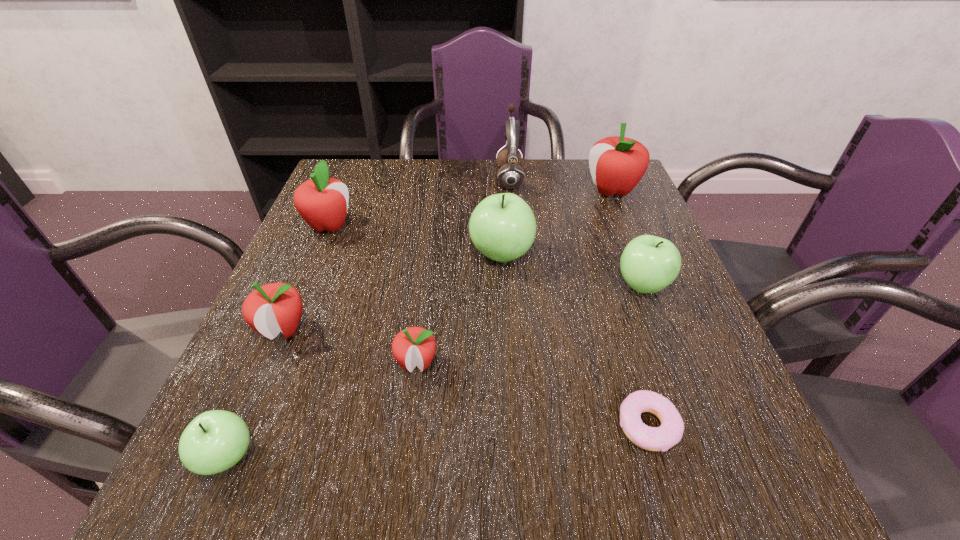
In order to click on object that is positioned at the near left corner in this screenshot , I will do `click(214, 441)`.

You are a GUI agent. You are given a task and a screenshot of the screen. Output one action in this format:
    pyautogui.click(x=<x>, y=<y>)
    Task: Click on the object present at the far right corner
    
    Given the screenshot: What is the action you would take?
    pyautogui.click(x=617, y=164)

You are a GUI agent. You are given a task and a screenshot of the screen. Output one action in this format:
    pyautogui.click(x=<x>, y=<y>)
    Task: Click on the object present at the near right corner
    This screenshot has width=960, height=540.
    Given the screenshot: What is the action you would take?
    pyautogui.click(x=669, y=433)

Identify the location of free spot at the far edge of the desktop. The image size is (960, 540). (461, 181).

Where is `vacant region at the near edge of the desktop`? The width and height of the screenshot is (960, 540). vacant region at the near edge of the desktop is located at coordinates (514, 450).

At what (x,y) coordinates should I click in order to perform the action: click on vacant space at the left edge of the desktop. Please return your answer as a coordinate pair (x, y). This screenshot has width=960, height=540. Looking at the image, I should click on pos(282,399).

The image size is (960, 540). I want to click on vacant space at the right edge of the desktop, so (x=707, y=341).

At what (x,y) coordinates should I click in order to perform the action: click on vacant region at the far left corner. Please return your answer as a coordinate pair (x, y). This screenshot has height=540, width=960. Looking at the image, I should click on (382, 173).

This screenshot has width=960, height=540. What are the coordinates of `free point between the second biggest green apple and the third biggest red apple` in the screenshot? It's located at (463, 307).

Locate an element on the screen. vacant area between the second biggest red apple and the nearest apple is located at coordinates (278, 341).